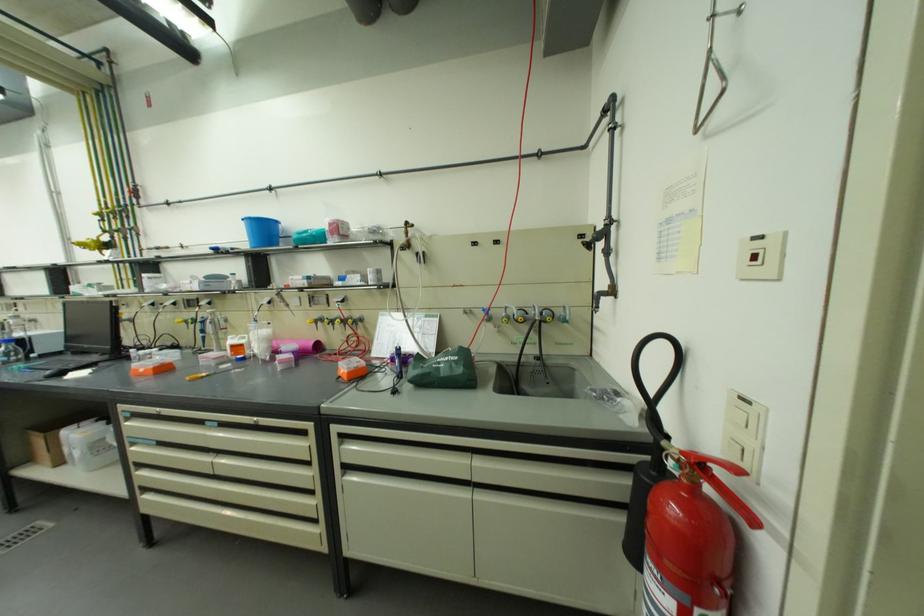
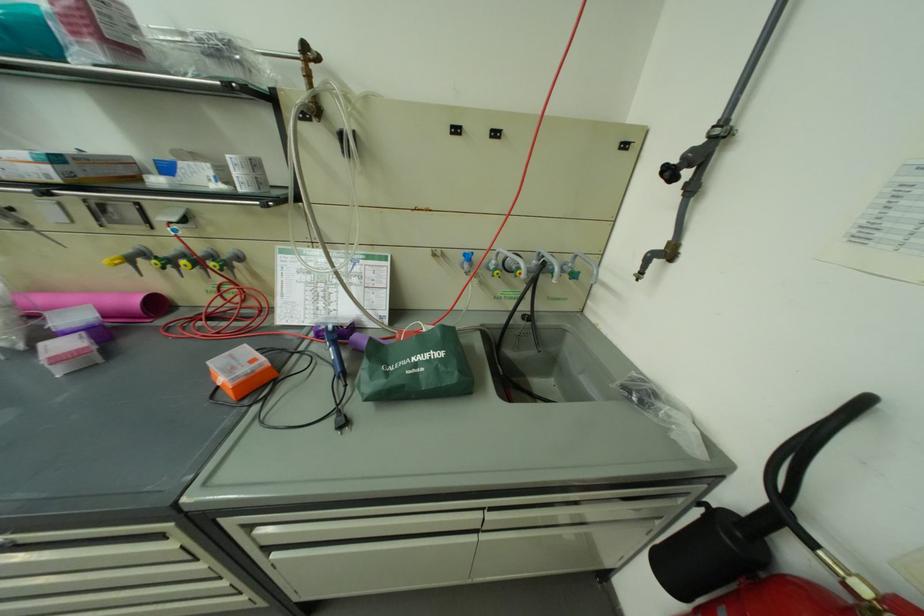
The images are taken continuously from a first-person perspective. In which direction is your viewpoint rotating?

The rotation direction of the camera is right-down.